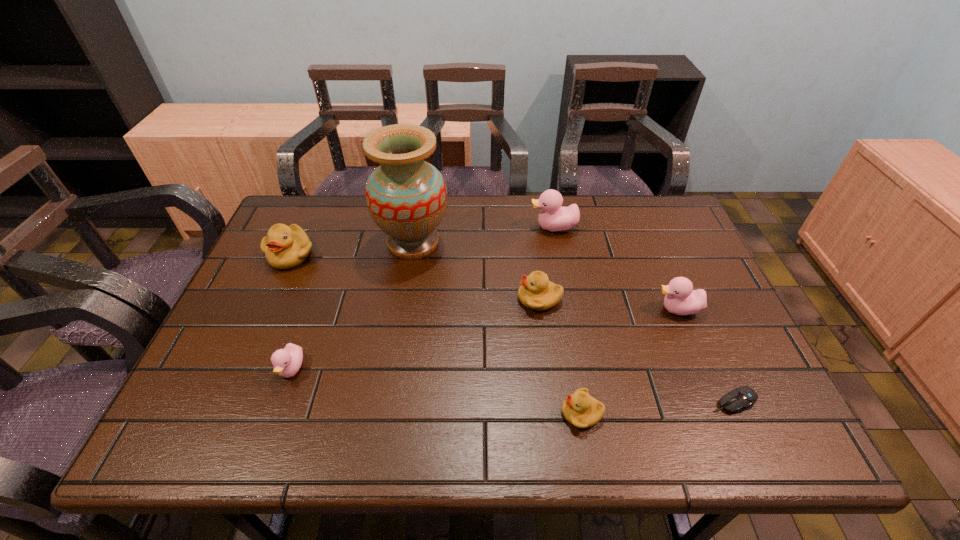
Where is `the second closest yellow duckling to the shortest object`? the second closest yellow duckling to the shortest object is located at coordinates (536, 292).

Identify which yellow duckling is the third closest to the tallest object. Please provide its 2D coordinates. Your answer should be formatted as a tuple, i.e. [(x, y)], where the tuple contains the x and y coordinates of a point satisfying the conditions above.

[(580, 409)]

The height and width of the screenshot is (540, 960). Find the location of `free space that satisfies the following two spatial constraints: 1. on the front-facing side of the shortest object; 2. on the right side of the second pink duckling from right to left`. free space that satisfies the following two spatial constraints: 1. on the front-facing side of the shortest object; 2. on the right side of the second pink duckling from right to left is located at coordinates (587, 402).

Where is `vacant area in the image that satisfies the following two spatial constraints: 1. on the front-facing side of the computer mouse; 2. on the right side of the rightmost pink duckling`? The image size is (960, 540). vacant area in the image that satisfies the following two spatial constraints: 1. on the front-facing side of the computer mouse; 2. on the right side of the rightmost pink duckling is located at coordinates (716, 402).

Identify the location of free location that satisfies the following two spatial constraints: 1. on the front-facing side of the computer mouse; 2. on the left side of the second nearest duckling. This screenshot has width=960, height=540. (280, 402).

Locate an element on the screen. This screenshot has height=540, width=960. free space that satisfies the following two spatial constraints: 1. on the back side of the shortest object; 2. on the front-facing side of the rightmost duckling is located at coordinates (693, 309).